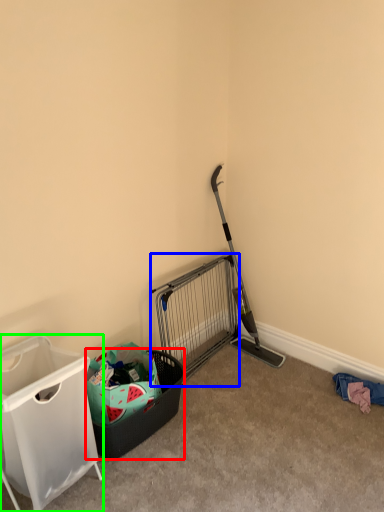
Question: Based on their relative distances, which object is farther from shopping basket (highlighted by a red box)? Choose from cage (highlighted by a blue box) and waste container (highlighted by a green box).

Choices:
 (A) cage
 (B) waste container

Answer: (A)